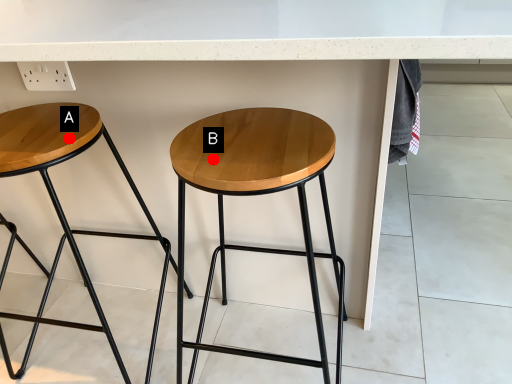
Question: Two points are circled on the image, labeled by A and B beside each circle. Among these points, which one is nearest to the camera?

Choices:
 (A) A is closer
 (B) B is closer

Answer: (B)